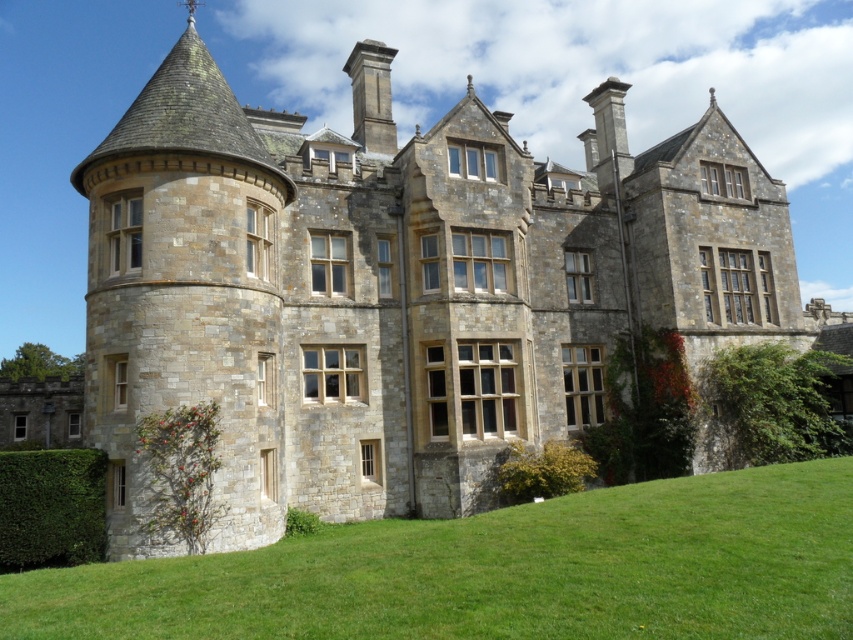
You are standing in front of the grand stone building and want to know the position of the green leafy hedge at right relative to the round turret on the left. Based on the coordinates provided, can you determine if the hedge is to the left or right of the turret?

The green leafy hedge at right is located at point (770, 404), which is to the right of the round turret on the left since the x coordinate is higher than the turret, indicating a position further to the right.

You are standing in front of the grand stone building and want to determine the relative positions of two points marked on the building. The first point is located at coordinates point (845, 452) and the second at point (79, 532). Which point is closer to you, the observer?

Point (845, 452) is further to the viewer than point (79, 532), so the point closer to you is point (79, 532).